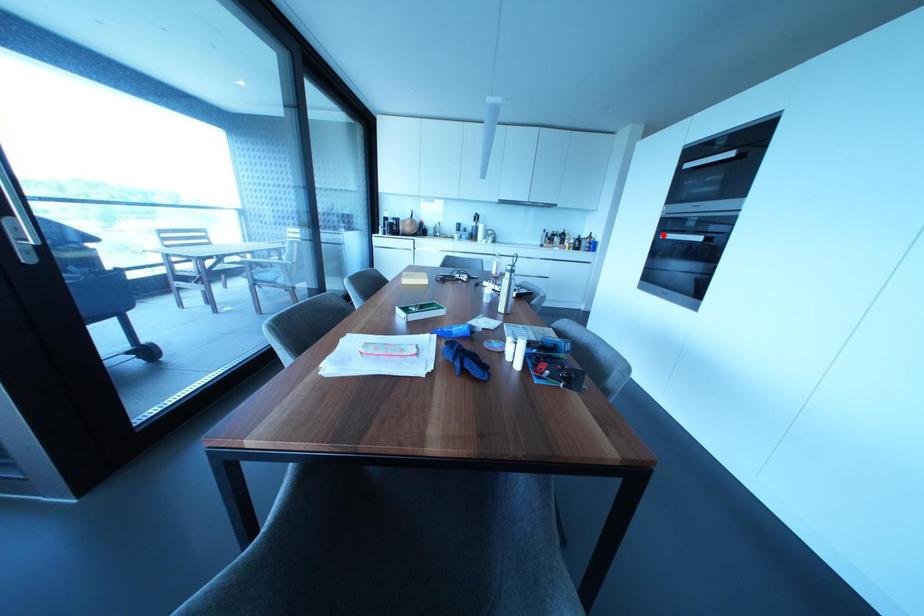
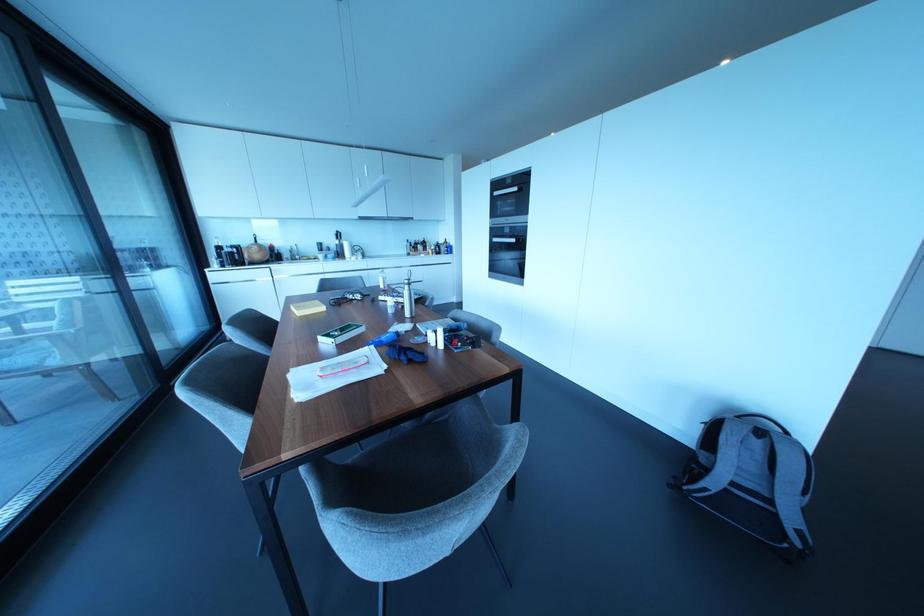
Find the pixel in the second image that matches the highlighted location in the first image.

(493, 238)